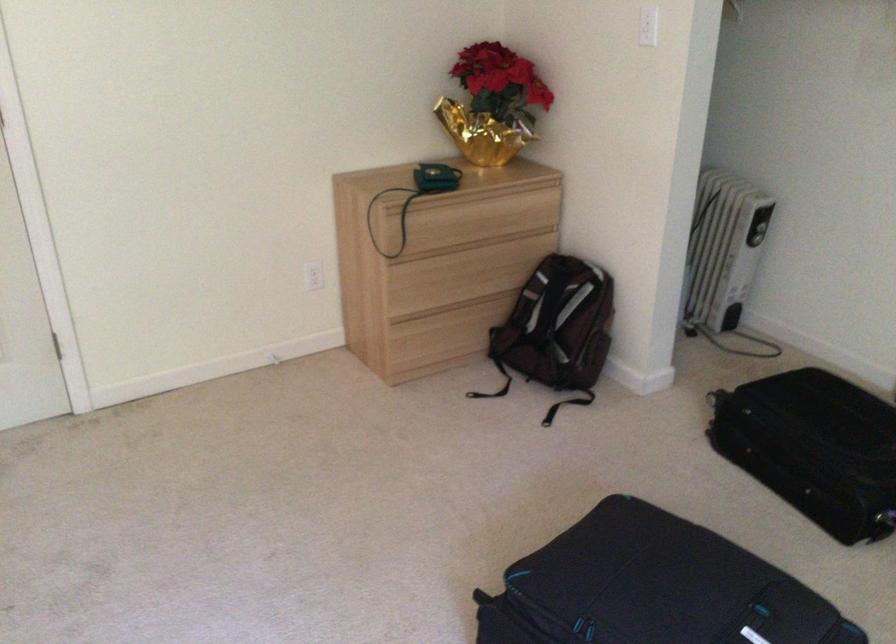
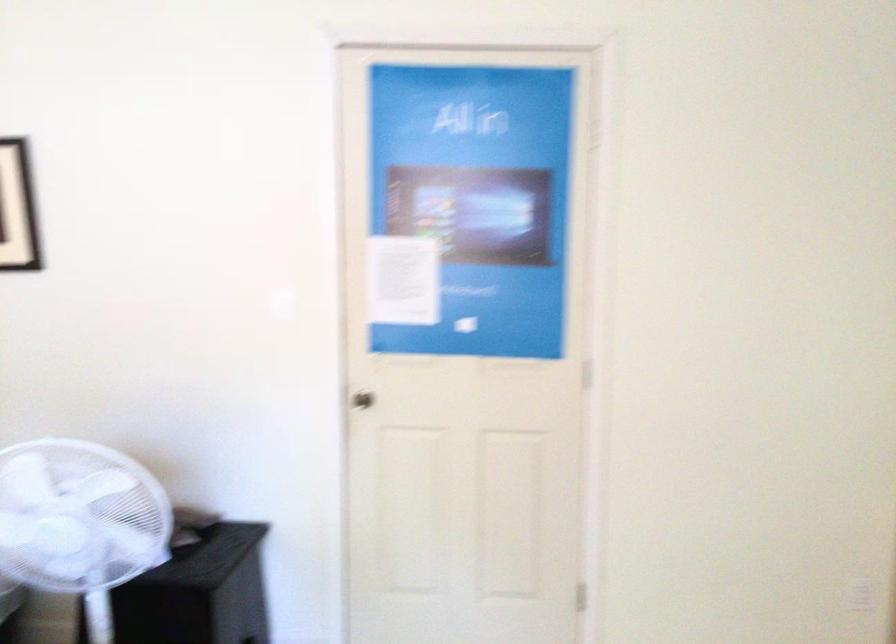
Question: The first image is from the beginning of the video and the second image is from the end. How did the camera likely rotate when shooting the video?

Choices:
 (A) Left
 (B) Right
 (C) Up
 (D) Down

Answer: (A)